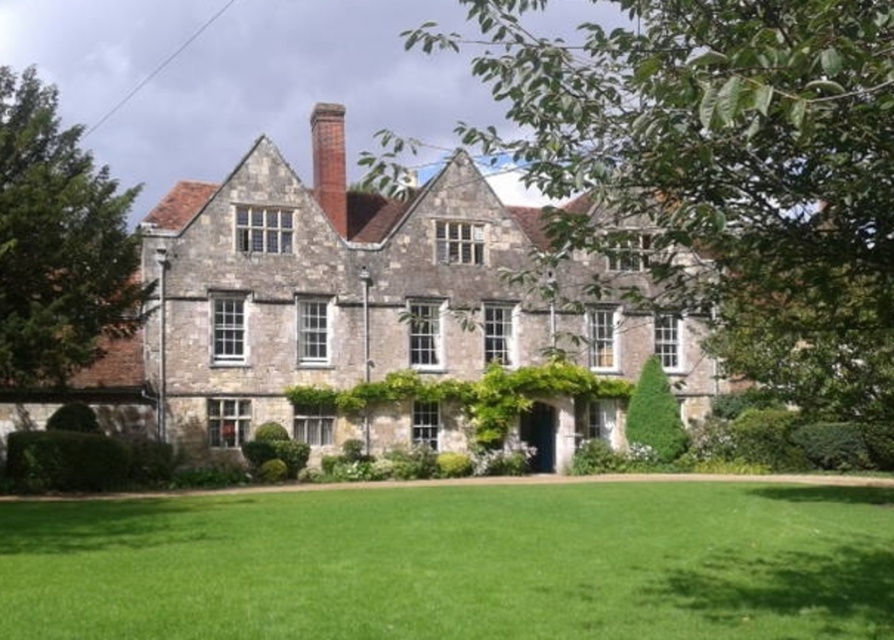
You are an architect designing a new garden layout for the historic stone building. You need to place a new statue exactly between the green leafy tree at upper left and the red brick chimney at center. Which object will have more space between the statue and itself?

The red brick chimney at center will have more space between the statue and itself because the green leafy tree at upper left is wider than the red brick chimney at center, so the statue will be placed closer to the wider tree to balance the distance.

You are a gardener planning to plant a row of flowers between the green grass at lower center and the red brick chimney at center. Based on their widths, which area should you choose to ensure the flowers have enough space to grow?

The green grass at lower center might be wider than the red brick chimney at center, so planting the flowers between the green grass at lower center and the red brick chimney at center would give them enough space since the green grass area is wider.